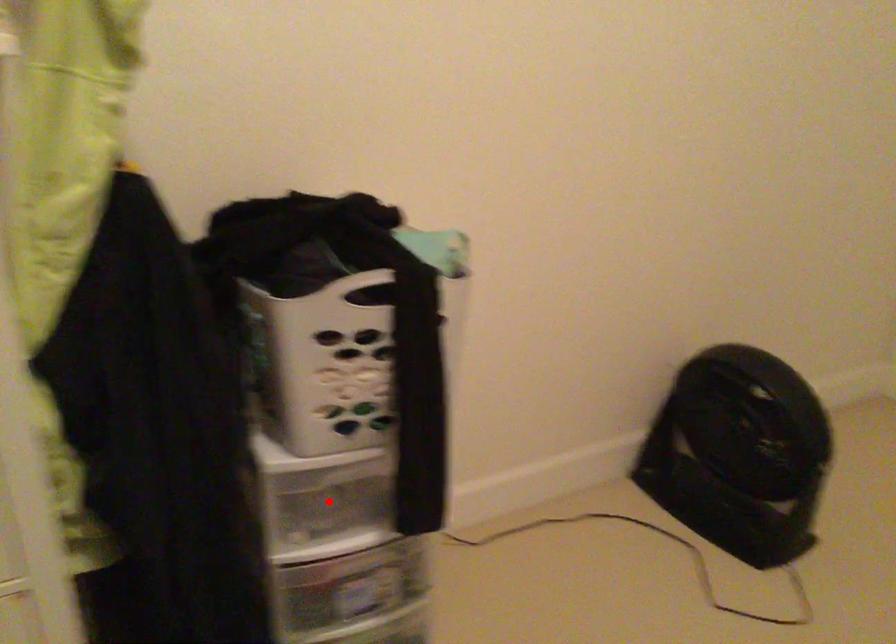
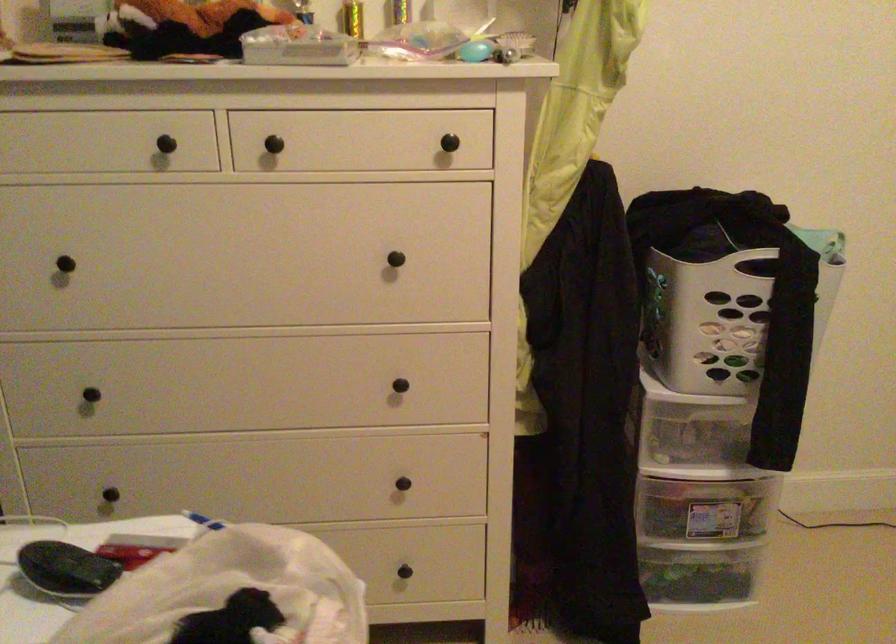
In the second image, find the point that corresponds to the highlighted location in the first image.

(695, 438)